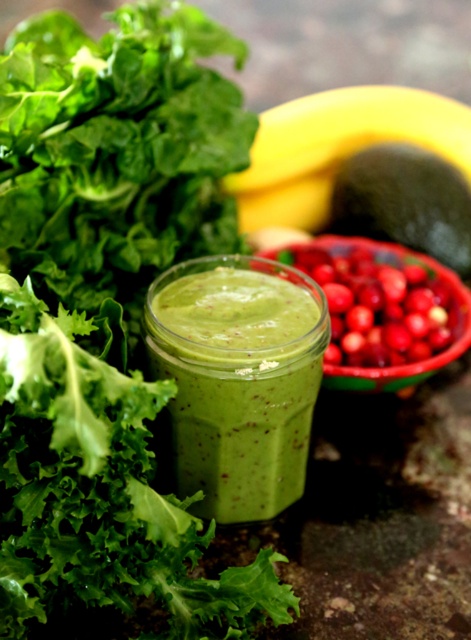
Question: Is green matte smoothie at center thinner than yellow matte banana at upper center?

Choices:
 (A) yes
 (B) no

Answer: (A)

Question: Considering the real-world distances, which object is farthest from the yellow matte banana at upper center?

Choices:
 (A) green matte smoothie at center
 (B) shiny red berries at center
 (C) green matte avocado at center-right

Answer: (A)

Question: Which point is farther to the camera?

Choices:
 (A) shiny red berries at center
 (B) yellow matte banana at upper center

Answer: (B)

Question: Which object is farther from the camera taking this photo?

Choices:
 (A) green matte smoothie at center
 (B) green matte avocado at center-right

Answer: (B)

Question: Does yellow matte banana at upper center lie behind shiny red berries at center?

Choices:
 (A) yes
 (B) no

Answer: (A)

Question: Does green matte smoothie at center have a lesser width compared to green matte avocado at center-right?

Choices:
 (A) no
 (B) yes

Answer: (B)